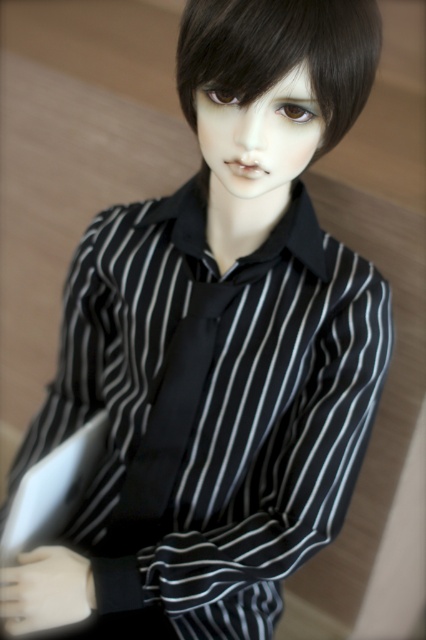
At what (x,y) coordinates should I click in order to perform the action: click on black silky hair at center. Please return your answer as a coordinate pair (x, y). The image size is (426, 640). Looking at the image, I should click on (281, 52).

Is black silky hair at center thinner than black satin tie at center?

No, black silky hair at center is not thinner than black satin tie at center.

Locate an element on the screen. black silky hair at center is located at coordinates (281, 52).